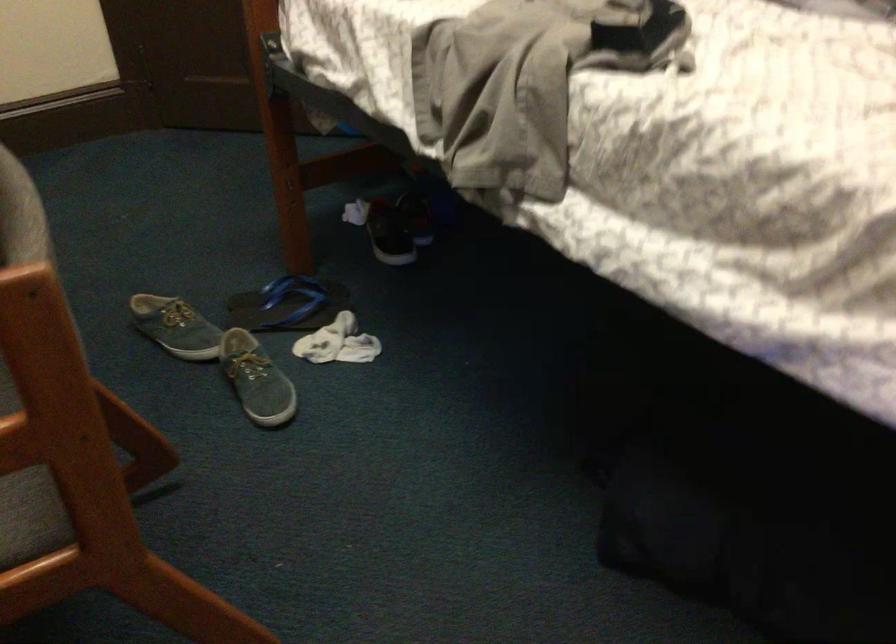
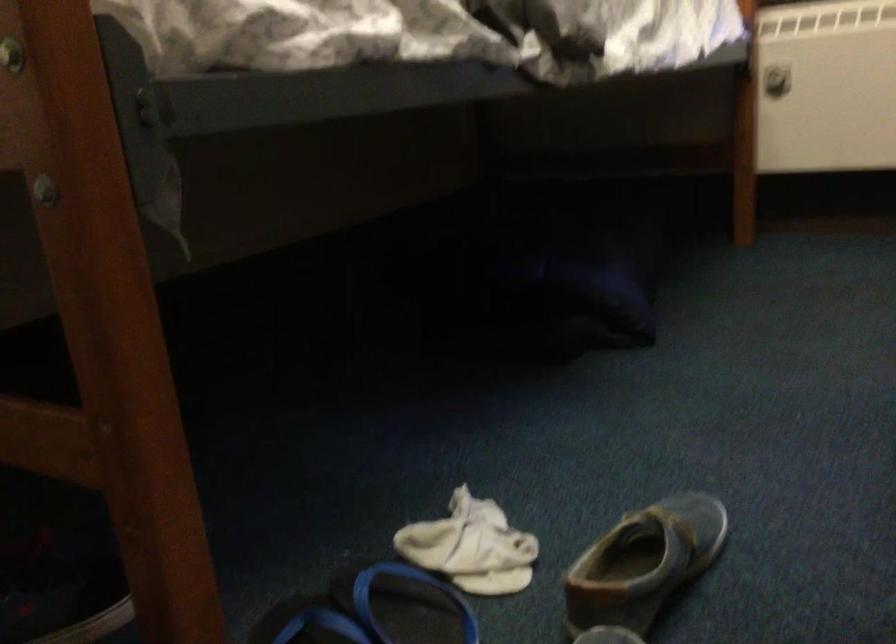
Locate, in the second image, the point that corresponds to point (305, 317) in the first image.

(406, 605)